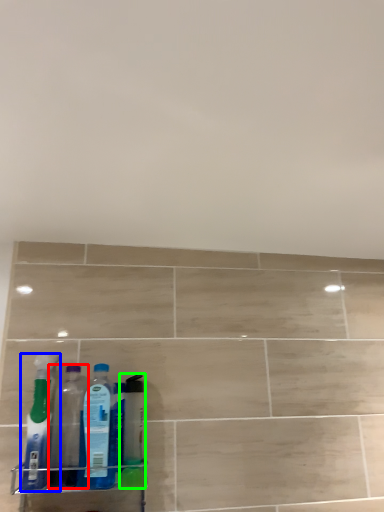
Question: Based on their relative distances, which object is farther from bottle (highlighted by a red box)? Choose from bottle (highlighted by a blue box) and cleaning product (highlighted by a green box).

Choices:
 (A) bottle
 (B) cleaning product

Answer: (B)